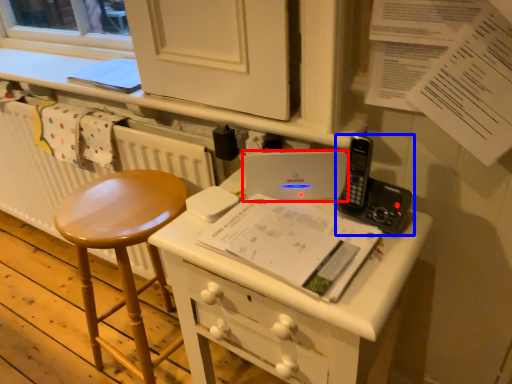
Question: Which object is closer to the camera taking this photo, laptop (highlighted by a red box) or equipment (highlighted by a blue box)?

Choices:
 (A) laptop
 (B) equipment

Answer: (B)